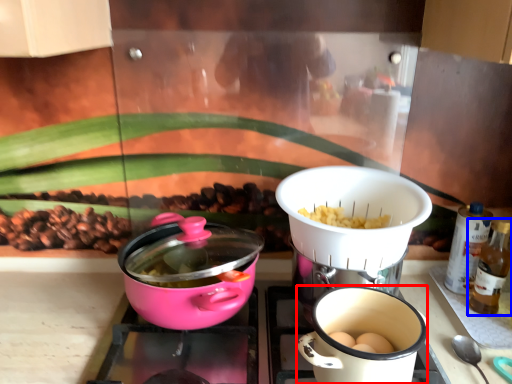
Question: Which object is further to the camera taking this photo, coffee cup (highlighted by a red box) or bottle (highlighted by a blue box)?

Choices:
 (A) coffee cup
 (B) bottle

Answer: (B)